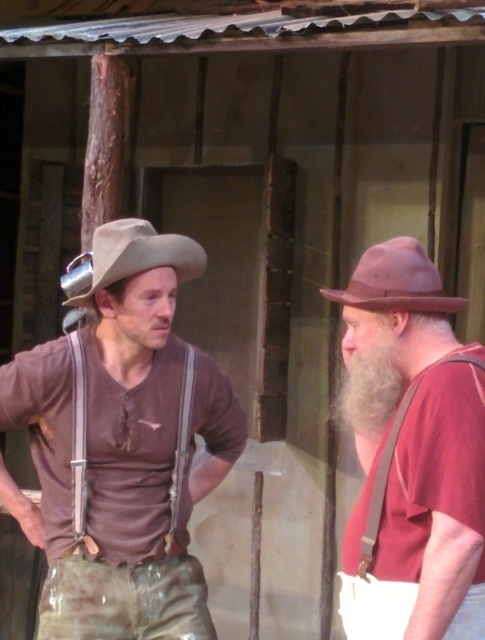
Can you confirm if matte brown hat at center is wider than pink felt hat at right?

Indeed, matte brown hat at center has a greater width compared to pink felt hat at right.

Is matte brown hat at center behind pink felt hat at right?

Yes.

Is point (84, 269) closer to viewer compared to point (357, 289)?

No, it is not.

Where is `matte brown hat at center`? Image resolution: width=485 pixels, height=640 pixels. matte brown hat at center is located at coordinates (129, 257).

Who is lower down, matte brown shirt at left or brown suede hat at right?

matte brown shirt at left is below.

Which is more to the left, matte brown shirt at left or brown suede hat at right?

matte brown shirt at left

Find the location of a particular element. matte brown shirt at left is located at coordinates (122, 448).

Who is lower down, matte brown shirt at left or brown fabric suspenders at left?

brown fabric suspenders at left

Does point (91, 506) lie behind point (85, 410)?

Yes, it is.

The height and width of the screenshot is (640, 485). Identify the location of matte brown shirt at left. (122, 448).